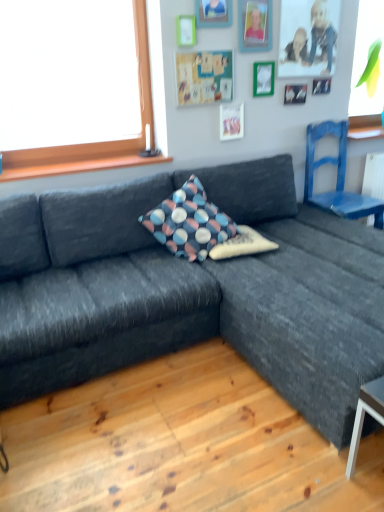
Question: In which direction should I rotate to look at textured fabric pillow at center, the 2th pillow positioned from the top?

Choices:
 (A) right
 (B) left

Answer: (A)

Question: Is dark gray fabric couch at center outside green matte picture frame at upper center, arranged as the 2th picture frame when viewed from the right?

Choices:
 (A) no
 (B) yes

Answer: (B)

Question: Does dark gray fabric couch at center have a larger size compared to green matte picture frame at upper center, the fifth picture frame in the left-to-right sequence?

Choices:
 (A) no
 (B) yes

Answer: (B)

Question: Is the depth of dark gray fabric couch at center greater than that of green matte picture frame at upper center, arranged as the 2th picture frame when viewed from the right?

Choices:
 (A) yes
 (B) no

Answer: (B)

Question: From the image's perspective, is dark gray fabric couch at center located beneath green matte picture frame at upper center, arranged as the 2th picture frame when viewed from the right?

Choices:
 (A) yes
 (B) no

Answer: (A)

Question: Is dark gray fabric couch at center at the right side of green matte picture frame at upper center, arranged as the 2th picture frame when viewed from the right?

Choices:
 (A) no
 (B) yes

Answer: (B)

Question: Is dark gray fabric couch at center directly adjacent to green matte picture frame at upper center, arranged as the 2th picture frame when viewed from the right?

Choices:
 (A) no
 (B) yes

Answer: (A)

Question: Does polka dot fabric pillow at center, which is counted as the second pillow, starting from the bottom, come in front of wooden picture frame at upper center, which appears as the fifth picture frame when viewed from the right?

Choices:
 (A) yes
 (B) no

Answer: (A)

Question: Considering the relative positions of polka dot fabric pillow at center, placed as the first pillow when sorted from top to bottom, and wooden picture frame at upper center, which appears as the fifth picture frame when viewed from the right, in the image provided, is polka dot fabric pillow at center, placed as the first pillow when sorted from top to bottom, to the left of wooden picture frame at upper center, which appears as the fifth picture frame when viewed from the right, from the viewer's perspective?

Choices:
 (A) yes
 (B) no

Answer: (A)

Question: Is polka dot fabric pillow at center, placed as the first pillow when sorted from top to bottom, thinner than wooden picture frame at upper center, the second picture frame when ordered from left to right?

Choices:
 (A) no
 (B) yes

Answer: (A)

Question: Is polka dot fabric pillow at center, which is counted as the second pillow, starting from the bottom, taller than wooden picture frame at upper center, the second picture frame when ordered from left to right?

Choices:
 (A) no
 (B) yes

Answer: (B)

Question: From a real-world perspective, is polka dot fabric pillow at center, which is counted as the second pillow, starting from the bottom, located higher than wooden picture frame at upper center, the second picture frame when ordered from left to right?

Choices:
 (A) yes
 (B) no

Answer: (B)

Question: Is polka dot fabric pillow at center, which is counted as the second pillow, starting from the bottom, positioned behind wooden picture frame at upper center, the second picture frame when ordered from left to right?

Choices:
 (A) yes
 (B) no

Answer: (B)

Question: Is textured fabric pillow at center, the 2th pillow positioned from the top, inside green matte picture frame at upper center, arranged as the 2th picture frame when viewed from the right?

Choices:
 (A) no
 (B) yes

Answer: (A)